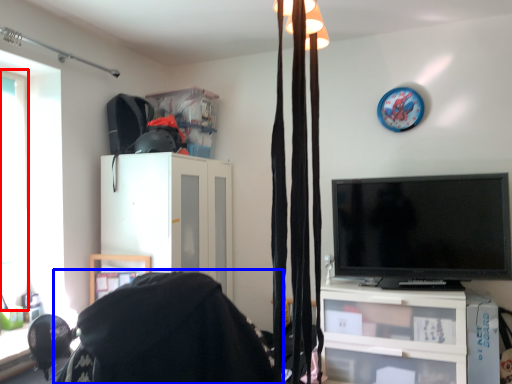
Question: Which of the following is the closest to the observer, window (highlighted by a red box) or bean bag chair (highlighted by a blue box)?

Choices:
 (A) window
 (B) bean bag chair

Answer: (B)